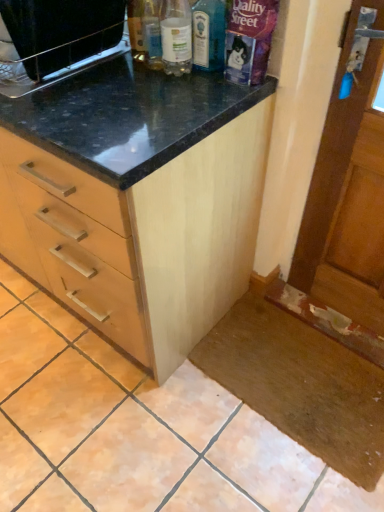
The width and height of the screenshot is (384, 512). I want to click on free space in front of translucent glass bottle at center, the 1th bottle when ordered from right to left, so pyautogui.click(x=199, y=91).